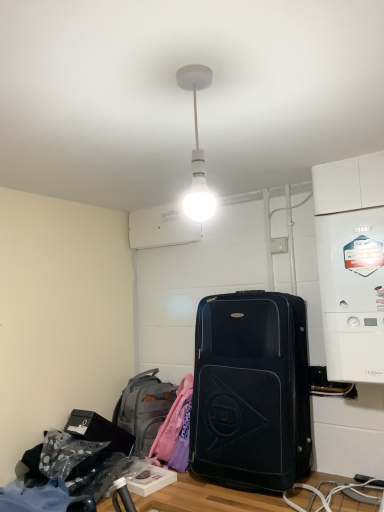
Locate an element on the screen. black fabric suitcase at center is located at coordinates (251, 391).

Locate an element on the screen. white plastic boiler at right is located at coordinates (352, 293).

How distant is white plastic boiler at right from gray fabric backpack at lower left?

They are 3.64 feet apart.

Is point (361, 340) closer or farther from the camera than point (127, 392)?

Point (361, 340) is positioned closer to the camera compared to point (127, 392).

Between white plastic boiler at right and gray fabric backpack at lower left, which one has smaller width?

white plastic boiler at right is thinner.

In the image, there is a gray fabric backpack at lower left. At what (x,y) coordinates should I click in order to perform the action: click on appliance above it (from the image's perspective). Please return your answer as a coordinate pair (x, y). Looking at the image, I should click on (352, 293).

Looking at this image, from a real-world perspective, is black fabric suitcase at center physically above white plastic boiler at right?

No, from a real-world perspective, black fabric suitcase at center is not over white plastic boiler at right

Between black fabric suitcase at center and white plastic boiler at right, which one appears on the left side from the viewer's perspective?

black fabric suitcase at center is more to the left.

You are a GUI agent. You are given a task and a screenshot of the screen. Output one action in this format:
    pyautogui.click(x=<x>, y=<y>)
    Task: Click on the appliance located on the right of black fabric suitcase at center
    This screenshot has height=512, width=384.
    Given the screenshot: What is the action you would take?
    pyautogui.click(x=352, y=293)

Is white matte bulb at center facing away from white plastic boiler at right?

Correct, white matte bulb at center is looking away from white plastic boiler at right.

From the image's perspective, would you say white matte bulb at center is shown under white plastic boiler at right?

Incorrect, from the image's perspective, white matte bulb at center is higher than white plastic boiler at right.

Considering the positions of objects white matte bulb at center and white plastic boiler at right in the image provided, who is more to the right, white matte bulb at center or white plastic boiler at right?

From the viewer's perspective, white plastic boiler at right appears more on the right side.

Is white matte bulb at center completely or partially outside of black fabric suitcase at center?

Indeed, white matte bulb at center is completely outside black fabric suitcase at center.

How much distance is there between white matte bulb at center and black fabric suitcase at center?

94.26 centimeters.

Are white matte bulb at center and black fabric suitcase at center located far from each other?

No, white matte bulb at center is in close proximity to black fabric suitcase at center.

Which object is thinner, white matte bulb at center or black fabric suitcase at center?

white matte bulb at center.

Considering the points (134, 431) and (192, 212), which point is behind, point (134, 431) or point (192, 212)?

The point (134, 431) is behind.

In the scene shown: Could you tell me if gray fabric backpack at lower left is facing white matte bulb at center?

No, gray fabric backpack at lower left does not turn towards white matte bulb at center.

Identify the location of backpack below the white matte bulb at center (from the image's perspective). (144, 409).

Which is more to the left, gray fabric backpack at lower left or white matte bulb at center?

From the viewer's perspective, gray fabric backpack at lower left appears more on the left side.

What's the angular difference between white plastic boiler at right and white matte bulb at center's facing directions?

white plastic boiler at right and white matte bulb at center are facing 0.764 degrees away from each other.

Who is shorter, white plastic boiler at right or white matte bulb at center?

white matte bulb at center.

Is white plastic boiler at right next to white matte bulb at center?

white plastic boiler at right and white matte bulb at center are not in contact.

From the image's perspective, is white plastic boiler at right positioned above or below white matte bulb at center?

white plastic boiler at right is situated lower than white matte bulb at center in the image.

This screenshot has height=512, width=384. I want to click on backpack on the left of the white matte bulb at center, so click(144, 409).

Is white matte bulb at center not within gray fabric backpack at lower left?

Yes, white matte bulb at center is not within gray fabric backpack at lower left.

Which of these two, white matte bulb at center or gray fabric backpack at lower left, stands shorter?

Standing shorter between the two is white matte bulb at center.

From a real-world perspective, is white matte bulb at center physically located above or below gray fabric backpack at lower left?

white matte bulb at center is situated higher than gray fabric backpack at lower left in the real world.

Locate an element on the screen. The height and width of the screenshot is (512, 384). appliance that appears above the gray fabric backpack at lower left (from the image's perspective) is located at coordinates (352, 293).

This screenshot has width=384, height=512. Identify the location of luggage and bags located behind the white plastic boiler at right. (251, 391).

Considering their positions, is white matte bulb at center positioned closer to gray fabric backpack at lower left than black fabric suitcase at center?

black fabric suitcase at center lies closer to gray fabric backpack at lower left than the other object.

Looking at this image, looking at the image, which one is located further to gray fabric backpack at lower left, black fabric suitcase at center or white matte bulb at center?

white matte bulb at center is further to gray fabric backpack at lower left.

From the image, which object appears to be nearer to gray fabric backpack at lower left, white matte bulb at center or white plastic boiler at right?

white plastic boiler at right is positioned closer to the anchor gray fabric backpack at lower left.

Which object lies further to the anchor point white plastic boiler at right, black fabric suitcase at center or gray fabric backpack at lower left?

gray fabric backpack at lower left lies further to white plastic boiler at right than the other object.

Based on their spatial positions, is gray fabric backpack at lower left or black fabric suitcase at center closer to white matte bulb at center?

black fabric suitcase at center is positioned closer to the anchor white matte bulb at center.

From the image, which object appears to be nearer to white plastic boiler at right, gray fabric backpack at lower left or white matte bulb at center?

white matte bulb at center lies closer to white plastic boiler at right than the other object.

Looking at the image, which one is located closer to white matte bulb at center, white plastic boiler at right or gray fabric backpack at lower left?

white plastic boiler at right lies closer to white matte bulb at center than the other object.

From the image, which object appears to be nearer to black fabric suitcase at center, gray fabric backpack at lower left or white matte bulb at center?

The object closer to black fabric suitcase at center is gray fabric backpack at lower left.

Where is `luggage and bags located between white matte bulb at center and gray fabric backpack at lower left in the depth direction`? luggage and bags located between white matte bulb at center and gray fabric backpack at lower left in the depth direction is located at coordinates (251, 391).

This screenshot has height=512, width=384. Find the location of `appliance positioned between white matte bulb at center and gray fabric backpack at lower left from near to far`. appliance positioned between white matte bulb at center and gray fabric backpack at lower left from near to far is located at coordinates (352, 293).

Where is `luggage and bags between gray fabric backpack at lower left and white plastic boiler at right from left to right`? This screenshot has height=512, width=384. luggage and bags between gray fabric backpack at lower left and white plastic boiler at right from left to right is located at coordinates (251, 391).

The image size is (384, 512). Identify the location of appliance between white matte bulb at center and black fabric suitcase at center vertically. (352, 293).